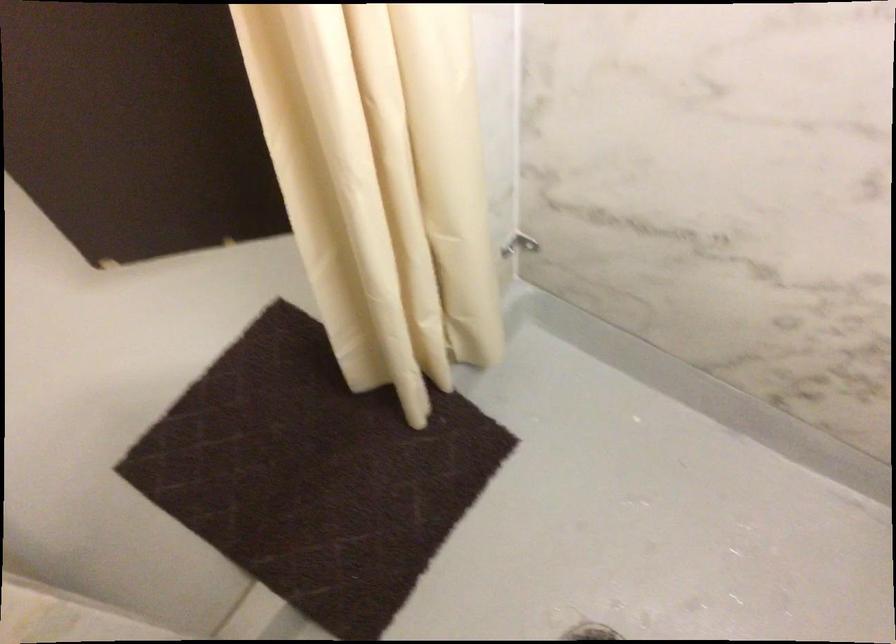
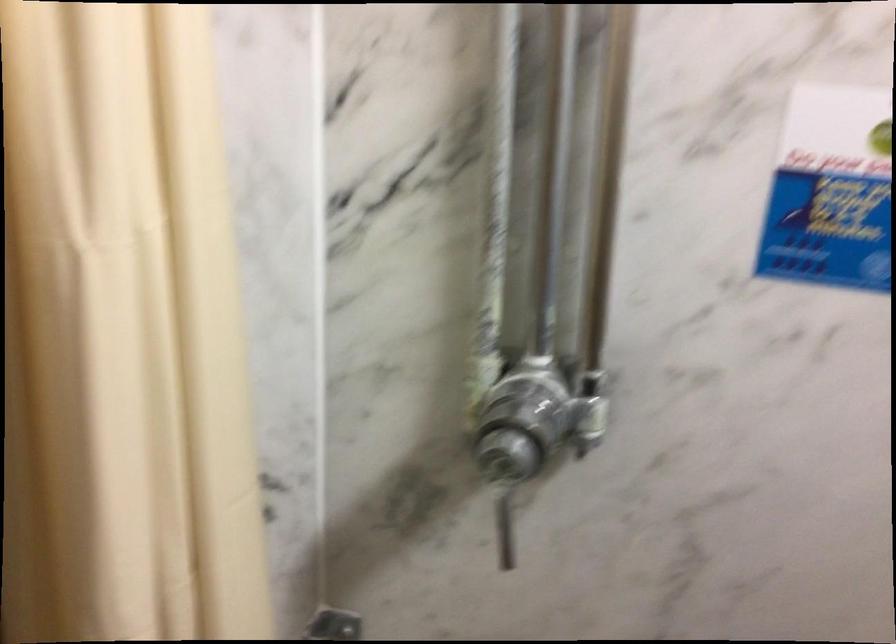
Question: What movement of the cameraman would produce the second image?

Choices:
 (A) Left
 (B) Right
 (C) Forward
 (D) Backward

Answer: (D)